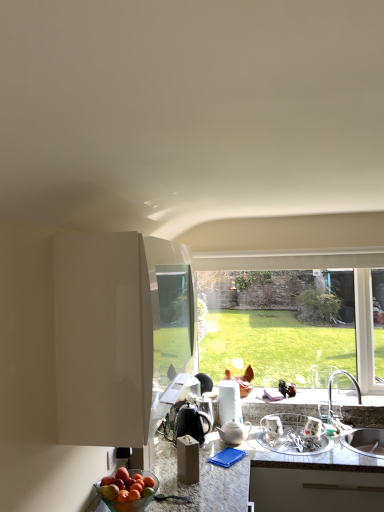
The width and height of the screenshot is (384, 512). Identify the location of clear glass window at center. (313, 268).

What do you see at coordinates (293, 434) in the screenshot? The height and width of the screenshot is (512, 384). I see `metallic silver dish rack at lower right, the 1th appliance viewed from the right` at bounding box center [293, 434].

How much space does metallic silver kettle at center, acting as the 2th appliance starting from the left, occupy horizontally?

It is 5.51 inches.

This screenshot has width=384, height=512. Describe the element at coordinates (206, 406) in the screenshot. I see `metallic silver kettle at center, the second appliance from the right` at that location.

You are a GUI agent. You are given a task and a screenshot of the screen. Output one action in this format:
    pyautogui.click(x=<x>, y=<y>)
    Task: Click on the white glossy cabinet at left
    The image size is (384, 512).
    Given the screenshot: What is the action you would take?
    pyautogui.click(x=119, y=334)

This screenshot has width=384, height=512. What do you see at coordinates (364, 441) in the screenshot?
I see `silver metallic sink at lower right` at bounding box center [364, 441].

The width and height of the screenshot is (384, 512). I want to click on shiny red apple at lower left, so tap(126, 487).

Does clear glass window at center have a lesser width compared to granite countertop at center?

Indeed, clear glass window at center has a lesser width compared to granite countertop at center.

From a real-world perspective, which object rests below the other?

granite countertop at center.

Considering the relative positions of clear glass window at center and granite countertop at center in the image provided, is clear glass window at center behind granite countertop at center?

Yes, it is behind granite countertop at center.

Looking at this image, considering the sizes of objects silver metallic sink at lower right and white glossy cabinet at left in the image provided, who is smaller, silver metallic sink at lower right or white glossy cabinet at left?

silver metallic sink at lower right.

Which is nearer, (361, 449) or (135, 254)?

The point (135, 254) is in front.

Consider the image. What's the angular difference between silver metallic sink at lower right and white glossy cabinet at left's facing directions?

The angle between the facing direction of silver metallic sink at lower right and the facing direction of white glossy cabinet at left is 90 degrees.

From a real-world perspective, is silver metallic sink at lower right on white glossy cabinet at left?

No, from a real-world perspective, silver metallic sink at lower right is not on top of white glossy cabinet at left.

Considering the sizes of metallic silver kettle at center, the second appliance from the right, and granite countertop at center in the image, is metallic silver kettle at center, the second appliance from the right, bigger or smaller than granite countertop at center?

Clearly, metallic silver kettle at center, the second appliance from the right, is smaller in size than granite countertop at center.

Which object is further away from the camera, metallic silver kettle at center, acting as the 2th appliance starting from the left, or granite countertop at center?

metallic silver kettle at center, acting as the 2th appliance starting from the left, is further away from the camera.

Considering the sizes of metallic silver kettle at center, the second appliance from the right, and granite countertop at center in the image, is metallic silver kettle at center, the second appliance from the right, taller or shorter than granite countertop at center?

Considering their sizes, metallic silver kettle at center, the second appliance from the right, has less height than granite countertop at center.

From the picture: From the image's perspective, which object appears higher, metallic silver kettle at center, the second appliance from the right, or granite countertop at center?

metallic silver kettle at center, the second appliance from the right, from the image's perspective.

How different are the orientations of metallic silver kettle at center, acting as the 2th appliance starting from the left, and shiny red apple at lower left in degrees?

metallic silver kettle at center, acting as the 2th appliance starting from the left, and shiny red apple at lower left are facing 95.1 degrees away from each other.

From the picture: Between metallic silver kettle at center, the second appliance from the right, and shiny red apple at lower left, which one has less height?

shiny red apple at lower left.

Is metallic silver kettle at center, the second appliance from the right, completely or partially outside of shiny red apple at lower left?

Yes.

Considering the sizes of objects metallic silver kettle at center, acting as the 2th appliance starting from the left, and shiny red apple at lower left in the image provided, who is bigger, metallic silver kettle at center, acting as the 2th appliance starting from the left, or shiny red apple at lower left?

shiny red apple at lower left.

Can you tell me how much white glossy cabinet at left and metallic silver dish rack at lower right, marked as the third appliance in a left-to-right arrangement, differ in facing direction?

white glossy cabinet at left and metallic silver dish rack at lower right, marked as the third appliance in a left-to-right arrangement, are facing 90 degrees away from each other.

Is white glossy cabinet at left touching metallic silver dish rack at lower right, the 1th appliance viewed from the right?

There is a gap between white glossy cabinet at left and metallic silver dish rack at lower right, the 1th appliance viewed from the right.

From the picture: Does white glossy cabinet at left turn towards metallic silver dish rack at lower right, marked as the third appliance in a left-to-right arrangement?

No, white glossy cabinet at left is not facing towards metallic silver dish rack at lower right, marked as the third appliance in a left-to-right arrangement.

From the image's perspective, between white glossy cabinet at left and metallic silver dish rack at lower right, the 1th appliance viewed from the right, who is located below?

metallic silver dish rack at lower right, the 1th appliance viewed from the right, is shown below in the image.

Which point is more distant from viewer, (111, 334) or (204, 436)?

The point (204, 436) is farther.

Could you tell me if white glossy cabinet at left is turned towards shiny metallic kettle at center, marked as the 3th appliance in a right-to-left arrangement?

No, white glossy cabinet at left is not facing towards shiny metallic kettle at center, marked as the 3th appliance in a right-to-left arrangement.

Considering the sizes of objects white glossy cabinet at left and shiny metallic kettle at center, acting as the first appliance starting from the left, in the image provided, who is bigger, white glossy cabinet at left or shiny metallic kettle at center, acting as the first appliance starting from the left,?

Bigger between the two is white glossy cabinet at left.

The width and height of the screenshot is (384, 512). In order to click on the 1st appliance to the right of the white glossy cabinet at left, counting from the anchor's position in this screenshot , I will do 191,423.

Would you say silver metallic sink at lower right is a long distance from clear glass window at center?

No, silver metallic sink at lower right is not far from clear glass window at center.

From the image's perspective, which one is positioned lower, silver metallic sink at lower right or clear glass window at center?

silver metallic sink at lower right appears lower in the image.

Can you confirm if silver metallic sink at lower right is thinner than clear glass window at center?

No.

From a real-world perspective, who is located higher, silver metallic sink at lower right or clear glass window at center?

clear glass window at center is physically above.

I want to click on window behind the granite countertop at center, so click(x=313, y=268).

Image resolution: width=384 pixels, height=512 pixels. There is a silver metallic sink at lower right. What are the coordinates of `cabinetry above it (from a real-world perspective)` in the screenshot? It's located at (119, 334).

From the image, which object appears to be farther from shiny metallic kettle at center, acting as the first appliance starting from the left, metallic silver dish rack at lower right, the 1th appliance viewed from the right, or white glossy cabinet at left?

Among the two, white glossy cabinet at left is located further to shiny metallic kettle at center, acting as the first appliance starting from the left.

Estimate the real-world distances between objects in this image. Which object is further from metallic silver kettle at center, acting as the 2th appliance starting from the left, metallic silver dish rack at lower right, marked as the third appliance in a left-to-right arrangement, or clear glass window at center?

clear glass window at center is positioned further to the anchor metallic silver kettle at center, acting as the 2th appliance starting from the left.

Looking at the image, which one is located further to silver metallic sink at lower right, white glossy cabinet at left or shiny red apple at lower left?

white glossy cabinet at left is further to silver metallic sink at lower right.

Based on their spatial positions, is metallic silver kettle at center, acting as the 2th appliance starting from the left, or granite countertop at center further from silver metallic sink at lower right?

metallic silver kettle at center, acting as the 2th appliance starting from the left, lies further to silver metallic sink at lower right than the other object.

Based on their spatial positions, is metallic silver kettle at center, the second appliance from the right, or shiny metallic kettle at center, marked as the 3th appliance in a right-to-left arrangement, closer to white glossy cabinet at left?

shiny metallic kettle at center, marked as the 3th appliance in a right-to-left arrangement, lies closer to white glossy cabinet at left than the other object.

When comparing their distances from metallic silver dish rack at lower right, marked as the third appliance in a left-to-right arrangement, does silver metallic sink at lower right or granite countertop at center seem closer?

granite countertop at center lies closer to metallic silver dish rack at lower right, marked as the third appliance in a left-to-right arrangement, than the other object.

From the image, which object appears to be farther from granite countertop at center, clear glass window at center or metallic silver dish rack at lower right, the 1th appliance viewed from the right?

clear glass window at center is further to granite countertop at center.

Looking at the image, which one is located further to shiny red apple at lower left, shiny metallic kettle at center, acting as the first appliance starting from the left, or metallic silver dish rack at lower right, marked as the third appliance in a left-to-right arrangement?

metallic silver dish rack at lower right, marked as the third appliance in a left-to-right arrangement, lies further to shiny red apple at lower left than the other object.

Locate an element on the screen. Image resolution: width=384 pixels, height=512 pixels. sink between granite countertop at center and clear glass window at center in the front-back direction is located at coordinates (364, 441).

Locate an element on the screen. apple between granite countertop at center and clear glass window at center along the z-axis is located at coordinates (126, 487).

Locate an element on the screen. apple between white glossy cabinet at left and clear glass window at center in the front-back direction is located at coordinates (126, 487).

I want to click on cabinetry between granite countertop at center and shiny metallic kettle at center, acting as the first appliance starting from the left, along the z-axis, so click(x=119, y=334).